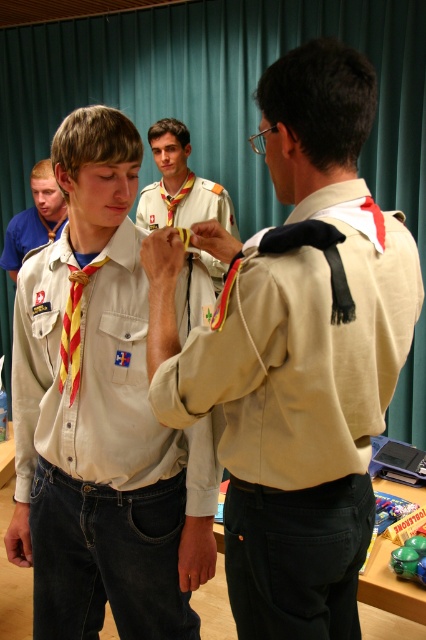
Does beige fabric uniform at center appear on the left side of matte khaki shirt at center?

No, beige fabric uniform at center is not to the left of matte khaki shirt at center.

Where is `beige fabric uniform at center`? Image resolution: width=426 pixels, height=640 pixels. beige fabric uniform at center is located at coordinates (241, 336).

In the scene shown: Who is more forward, (370, 602) or (210, 262)?

Positioned in front is point (370, 602).

You are a GUI agent. You are given a task and a screenshot of the screen. Output one action in this format:
    pyautogui.click(x=<x>, y=<y>)
    Task: Click on the beige fabric uniform at center
    Image resolution: width=426 pixels, height=640 pixels.
    Given the screenshot: What is the action you would take?
    pyautogui.click(x=241, y=336)

Who is lower down, yellow striped necktie at left or yellow/red striped tie at center?

yellow/red striped tie at center

Is yellow striped necktie at left to the left of yellow/red striped tie at center from the viewer's perspective?

Yes, yellow striped necktie at left is to the left of yellow/red striped tie at center.

The height and width of the screenshot is (640, 426). What do you see at coordinates (34, 218) in the screenshot?
I see `yellow striped necktie at left` at bounding box center [34, 218].

At what (x,y) coordinates should I click in order to perform the action: click on yellow striped necktie at left. Please return your answer as a coordinate pair (x, y). The width and height of the screenshot is (426, 640). Looking at the image, I should click on (34, 218).

Does beige fabric uniform at center have a larger size compared to yellow striped necktie at left?

Yes, beige fabric uniform at center is bigger than yellow striped necktie at left.

Between beige fabric uniform at center and yellow striped necktie at left, which one appears on the right side from the viewer's perspective?

From the viewer's perspective, beige fabric uniform at center appears more on the right side.

Who is more forward, (189, 467) or (13, 240)?

Point (189, 467)

Find the location of a particular element. This screenshot has width=426, height=640. beige fabric uniform at center is located at coordinates (241, 336).